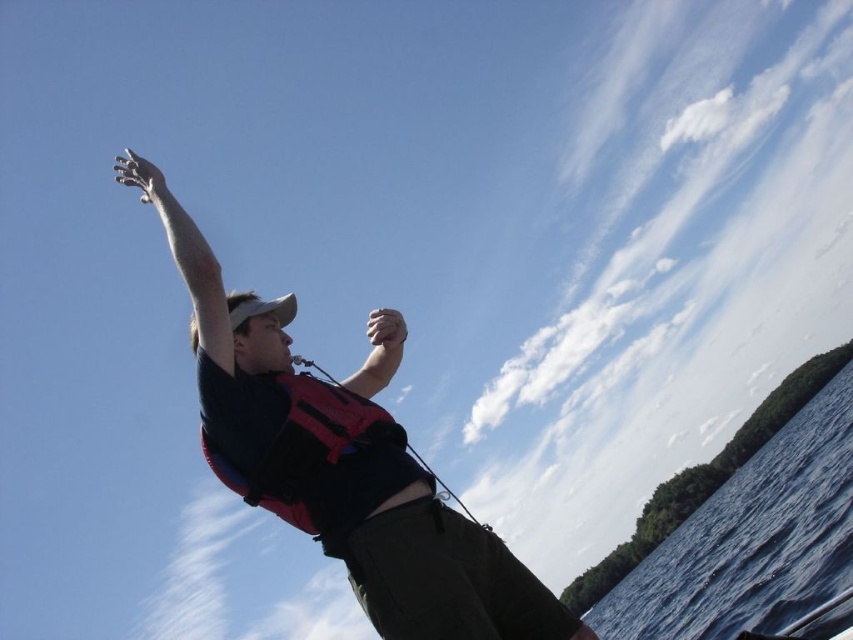
The width and height of the screenshot is (853, 640). What are the coordinates of `blue liquid water at lower right` in the screenshot? It's located at (752, 540).

At what (x,y) coordinates should I click in order to perform the action: click on blue liquid water at lower right. Please return your answer as a coordinate pair (x, y). Looking at the image, I should click on (752, 540).

Where is `red life vest at center`? The width and height of the screenshot is (853, 640). red life vest at center is located at coordinates coord(341,460).

Between red life vest at center and blue liquid water at lower right, which one is positioned lower?

blue liquid water at lower right

Which is in front, point (384, 484) or point (750, 552)?

Positioned in front is point (384, 484).

In order to click on red life vest at center in this screenshot , I will do `click(341, 460)`.

Consider the image. Which is above, red life vest at center or red fabric life jacket at center?

Positioned higher is red life vest at center.

In the scene shown: Does red life vest at center appear on the left side of red fabric life jacket at center?

In fact, red life vest at center is to the right of red fabric life jacket at center.

Who is more forward, (277, 420) or (210, 452)?

Positioned in front is point (210, 452).

Identify the location of red life vest at center. This screenshot has width=853, height=640. (341, 460).